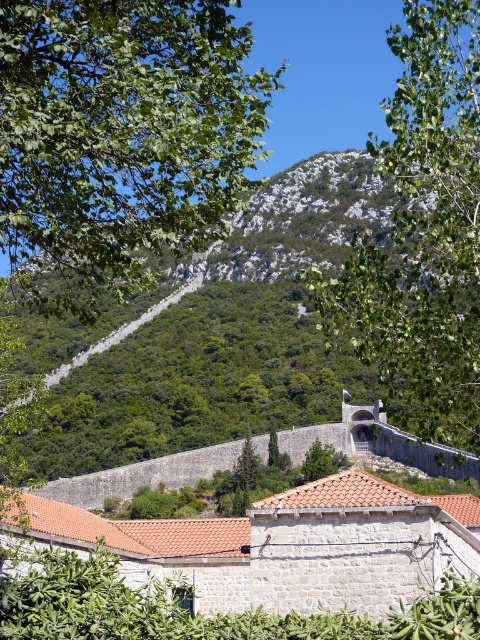
Does green leafy mountain at center have a greater width compared to green leafy tree at upper center?

Yes.

Does green leafy mountain at center come in front of green leafy tree at upper center?

No, it is behind green leafy tree at upper center.

Is point (385, 180) farther from viewer compared to point (436, 200)?

Yes, it is.

Locate an element on the screen. This screenshot has width=480, height=640. green leafy mountain at center is located at coordinates (216, 333).

Can you confirm if green leafy mountain at center is smaller than green leafy tree at center?

No.

At what (x,y) coordinates should I click in order to perform the action: click on green leafy mountain at center. Please return your answer as a coordinate pair (x, y). This screenshot has width=480, height=640. Looking at the image, I should click on (216, 333).

Is green leafy tree at upper left to the right of green leafy mountain at center from the viewer's perspective?

Incorrect, green leafy tree at upper left is not on the right side of green leafy mountain at center.

Which is above, green leafy tree at upper left or green leafy mountain at center?

green leafy tree at upper left

You are a GUI agent. You are given a task and a screenshot of the screen. Output one action in this format:
    pyautogui.click(x=<x>, y=<y>)
    Task: Click on the green leafy tree at upper left
    Image resolution: width=480 pixels, height=640 pixels.
    Given the screenshot: What is the action you would take?
    pyautogui.click(x=120, y=140)